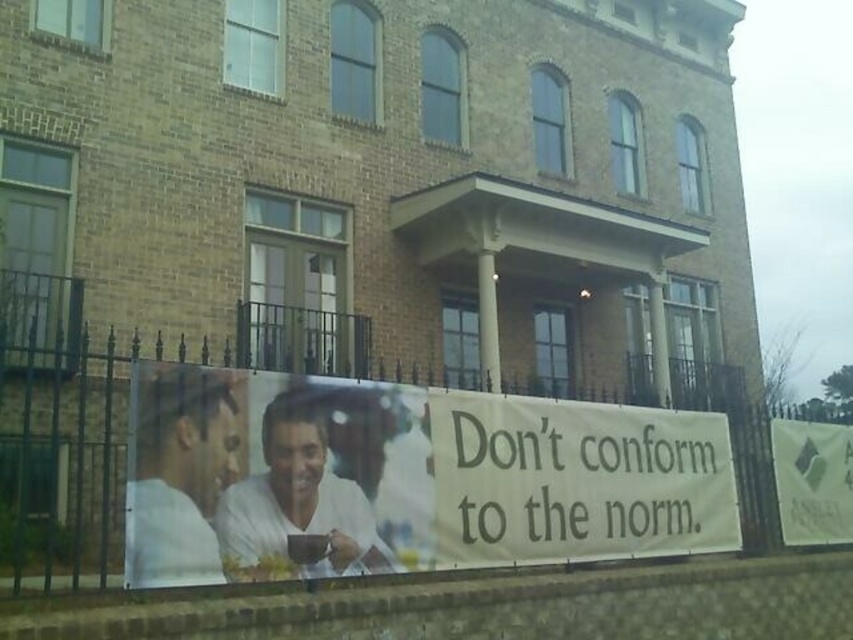
You are organizing an event and need to know which object is taller between the white paper banner at center and the green fabric sign at lower right. Based on the scene description, which one is taller?

The white paper banner at center is taller than the green fabric sign at lower right according to the description.

What is located at the coordinates point (575, 481)?

The white paper banner at center is located at point (575, 481).